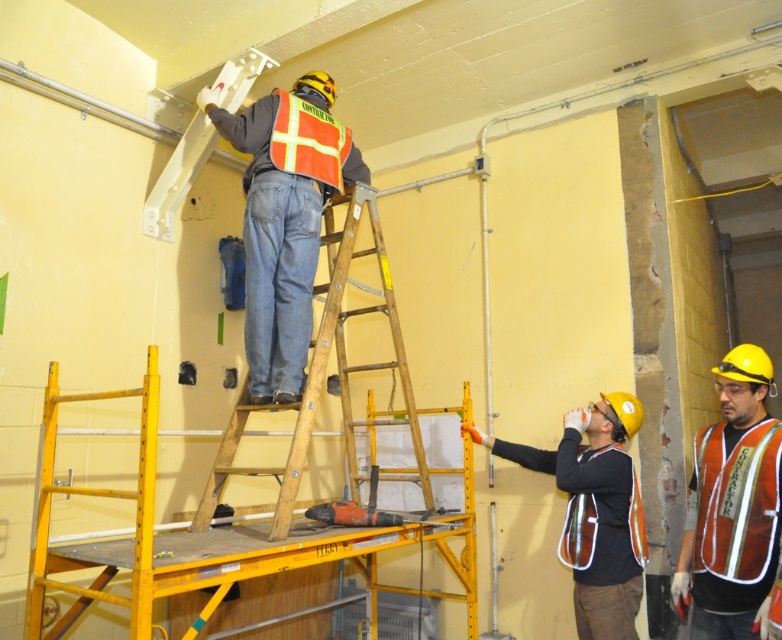
You are a safety inspector in the construction site. You need to check the distance between two points marked in the image. The points are point (777, 508) and point (350, 417). According to the description, which point is closer to you?

Point (777, 508) is in front of point (350, 417), so it is closer to you.

You are a safety inspector standing at the point marked as point (730, 536). You need to check the distance between the two workers to the right of the scaffolding. Can you confirm if they are maintaining a safe distance of at least 3 meters apart?

The two workers to the right of the scaffolding are 2.56 meters apart, which is less than the required 3 meters. Therefore, they are not maintaining a safe distance.